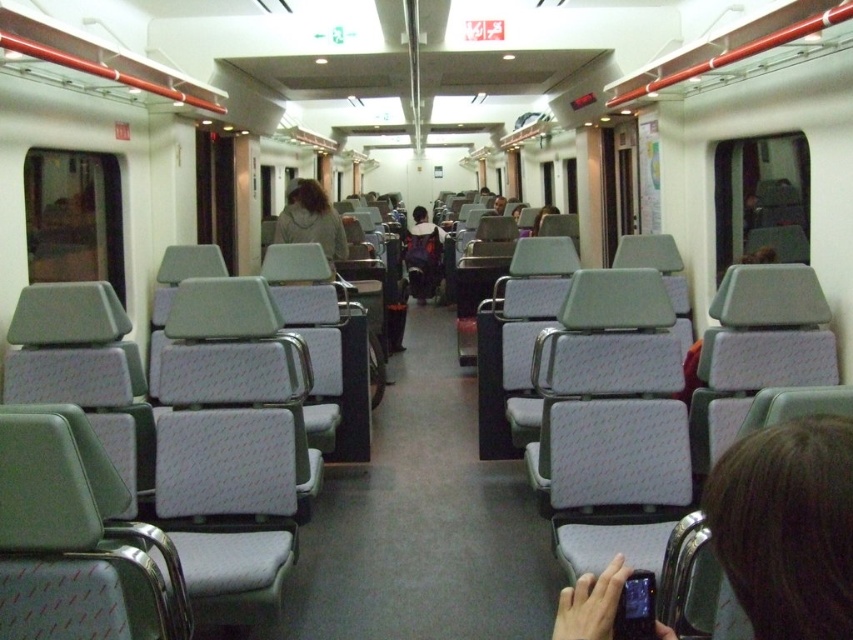
This screenshot has width=853, height=640. Describe the element at coordinates (787, 525) in the screenshot. I see `gray fabric seat at lower right` at that location.

Is gray fabric seat at lower right bigger than dark gray fabric backpack at center?

No, gray fabric seat at lower right is not bigger than dark gray fabric backpack at center.

Between point (753, 467) and point (431, 246), which one is positioned behind?

The point (431, 246) is behind.

Find the location of `gray fabric seat at lower right`. gray fabric seat at lower right is located at coordinates (787, 525).

You are a GUI agent. You are given a task and a screenshot of the screen. Output one action in this format:
    pyautogui.click(x=<x>, y=<y>)
    Task: Click on the dark gray fabric backpack at center
    Image resolution: width=853 pixels, height=640 pixels.
    Given the screenshot: What is the action you would take?
    pyautogui.click(x=424, y=256)

Can you confirm if light gray fabric jacket at center is positioned to the left of dark gray fabric backpack at center?

Yes, light gray fabric jacket at center is to the left of dark gray fabric backpack at center.

What do you see at coordinates (311, 220) in the screenshot? I see `light gray fabric jacket at center` at bounding box center [311, 220].

Is point (302, 195) closer to viewer compared to point (440, 244)?

Yes, point (302, 195) is in front of point (440, 244).

Where is `light gray fabric jacket at center`? This screenshot has height=640, width=853. light gray fabric jacket at center is located at coordinates (311, 220).